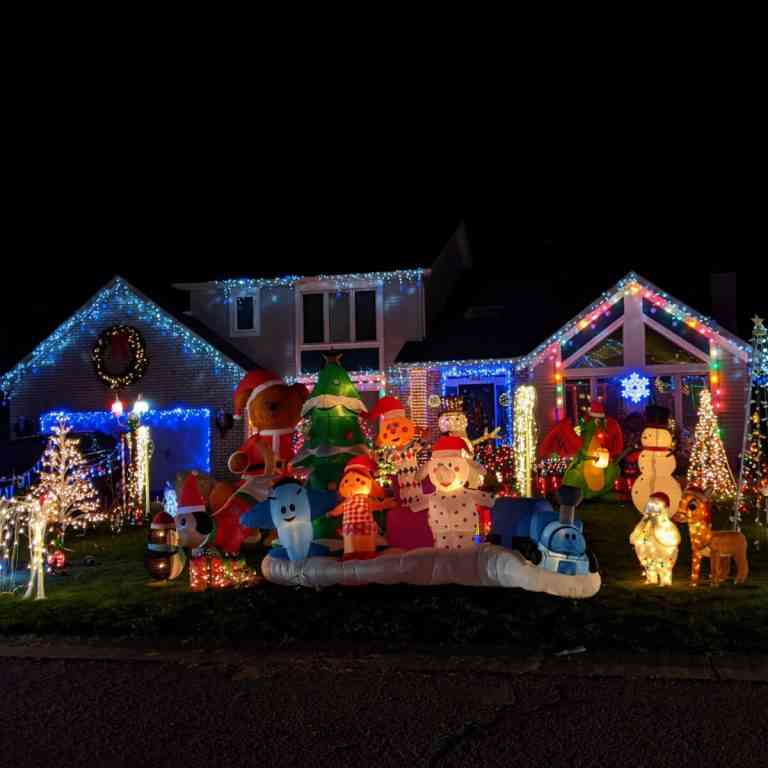
Find the location of a particular element. Image resolution: width=768 pixels, height=768 pixels. christmas decor is located at coordinates 392,467.